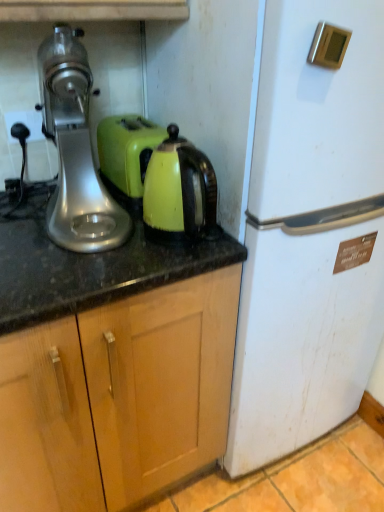
Question: Is silver metallic stand mixer at left closer to the viewer compared to matte green kettle at center?

Choices:
 (A) no
 (B) yes

Answer: (B)

Question: Does silver metallic stand mixer at left have a smaller size compared to matte green kettle at center?

Choices:
 (A) no
 (B) yes

Answer: (A)

Question: Considering the relative positions of silver metallic stand mixer at left and matte green kettle at center in the image provided, is silver metallic stand mixer at left behind matte green kettle at center?

Choices:
 (A) no
 (B) yes

Answer: (A)

Question: Can you confirm if silver metallic stand mixer at left is shorter than matte green kettle at center?

Choices:
 (A) no
 (B) yes

Answer: (A)

Question: From the image's perspective, is silver metallic stand mixer at left located above matte green kettle at center?

Choices:
 (A) yes
 (B) no

Answer: (A)

Question: Is white matte refrigerator at right situated inside matte green kettle at center or outside?

Choices:
 (A) inside
 (B) outside

Answer: (B)

Question: Considering the positions of point (345, 179) and point (173, 147), is point (345, 179) closer or farther from the camera than point (173, 147)?

Choices:
 (A) farther
 (B) closer

Answer: (A)

Question: Considering the positions of white matte refrigerator at right and matte green kettle at center in the image, is white matte refrigerator at right wider or thinner than matte green kettle at center?

Choices:
 (A) thin
 (B) wide

Answer: (B)

Question: Would you say white matte refrigerator at right is to the left or to the right of matte green kettle at center in the picture?

Choices:
 (A) left
 (B) right

Answer: (B)

Question: Is silver metallic plug at left wider or thinner than matte green kettle at center?

Choices:
 (A) wide
 (B) thin

Answer: (B)

Question: Do you think silver metallic plug at left is within matte green kettle at center, or outside of it?

Choices:
 (A) outside
 (B) inside

Answer: (A)

Question: Considering the positions of silver metallic plug at left and matte green kettle at center in the image, is silver metallic plug at left bigger or smaller than matte green kettle at center?

Choices:
 (A) small
 (B) big

Answer: (A)

Question: Is point (34, 123) positioned closer to the camera than point (175, 218)?

Choices:
 (A) farther
 (B) closer

Answer: (A)

Question: From the image's perspective, is matte green kettle at center above or below silver metallic plug at left?

Choices:
 (A) above
 (B) below

Answer: (B)

Question: In terms of width, does matte green kettle at center look wider or thinner when compared to silver metallic plug at left?

Choices:
 (A) wide
 (B) thin

Answer: (A)